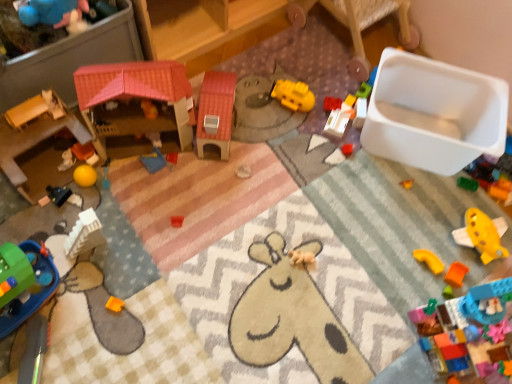
Locate an element on the screen. The image size is (512, 384). free space in front of matte orange blocks at left, positioned as the fifth toy in left-to-right order is located at coordinates (68, 208).